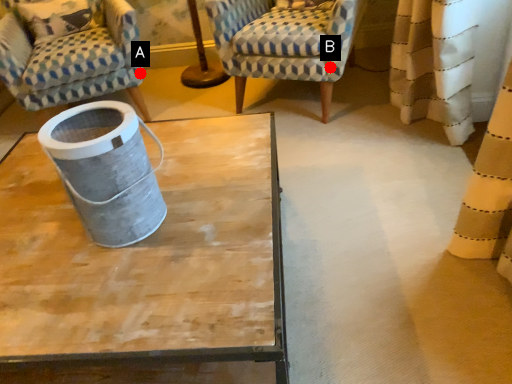
Question: Two points are circled on the image, labeled by A and B beside each circle. Which point is closer to the camera?

Choices:
 (A) A is closer
 (B) B is closer

Answer: (B)